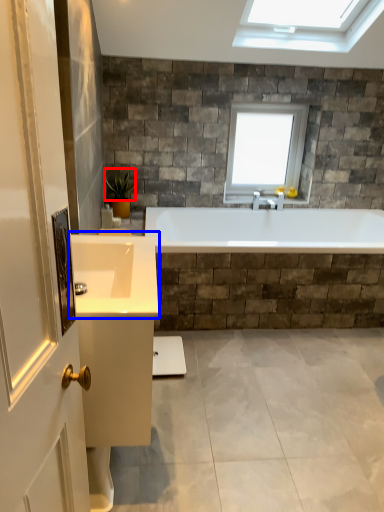
Question: Which object is further to the camera taking this photo, plant (highlighted by a red box) or sink (highlighted by a blue box)?

Choices:
 (A) plant
 (B) sink

Answer: (A)